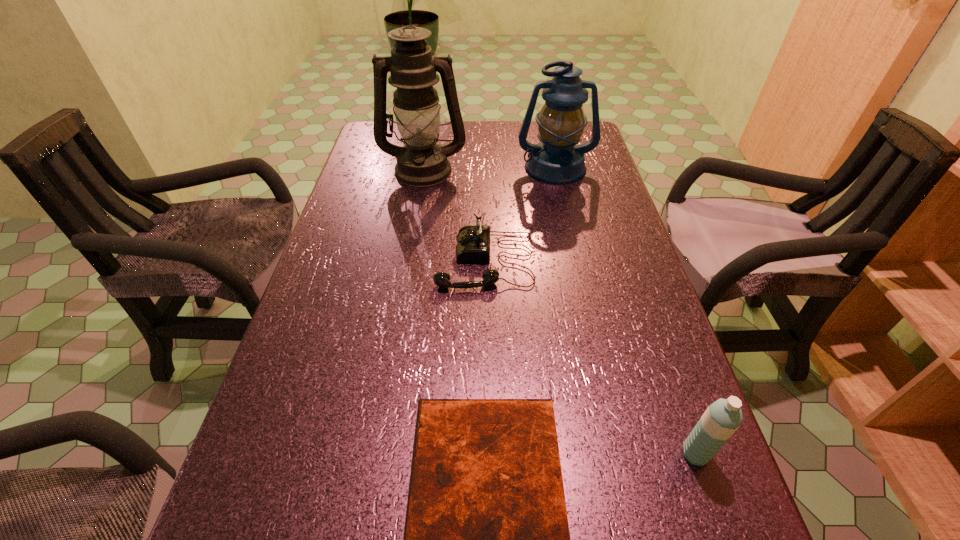
The image size is (960, 540). Find the location of `the tallest object`. the tallest object is located at coordinates (422, 162).

Where is `the second tallest object`? The width and height of the screenshot is (960, 540). the second tallest object is located at coordinates (557, 159).

Locate an element on the screen. water bottle is located at coordinates (722, 418).

Identify the location of the third farthest object. Image resolution: width=960 pixels, height=540 pixels. (473, 245).

Where is `telephone`? Image resolution: width=960 pixels, height=540 pixels. telephone is located at coordinates (473, 245).

In order to click on free space located 0.370m on the right of the tallest object in this screenshot , I will do point(588,170).

Locate an element on the screen. The height and width of the screenshot is (540, 960). vacant region located 0.220m on the face of the lantern is located at coordinates (570, 233).

At what (x,y) coordinates should I click in order to perform the action: click on vacant space located on the back of the third tallest object. Please return your answer as a coordinate pair (x, y). Looking at the image, I should click on (671, 383).

This screenshot has height=540, width=960. Find the location of `vacant space located on the dial of the telephone`. vacant space located on the dial of the telephone is located at coordinates (361, 260).

At what (x,y) coordinates should I click in order to perform the action: click on vacant area located 0.200m on the dial of the telephone. Please return your answer as a coordinate pair (x, y). Looking at the image, I should click on (352, 260).